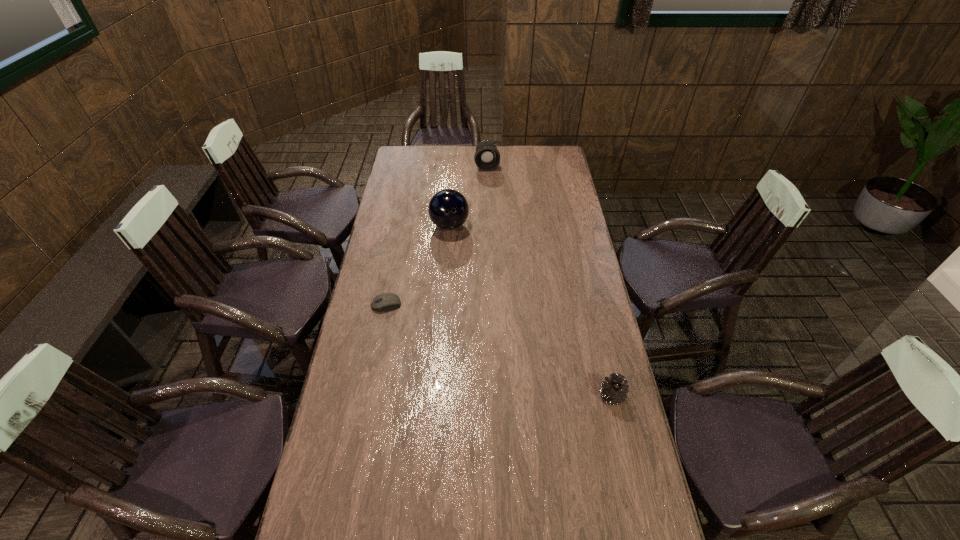
Find the location of a particular element. The image size is (960, 540). free space on the desktop that is between the leftmost object and the nearest object and is positioned at the front element of the third object from left to right is located at coordinates (508, 354).

This screenshot has height=540, width=960. Identify the location of vacant space on the desktop that is between the shortest object and the third tallest object and is positioned on the side of the tallest object with the finger holes. (516, 357).